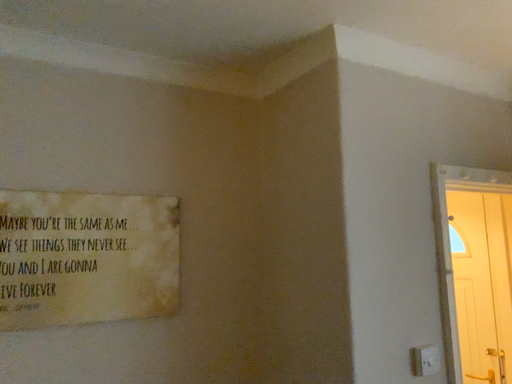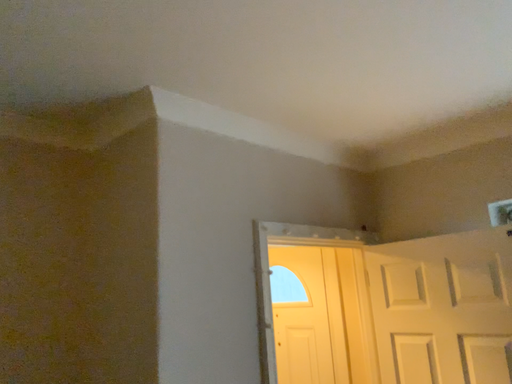
Question: How did the camera likely rotate when shooting the video?

Choices:
 (A) rotated right
 (B) rotated left

Answer: (A)